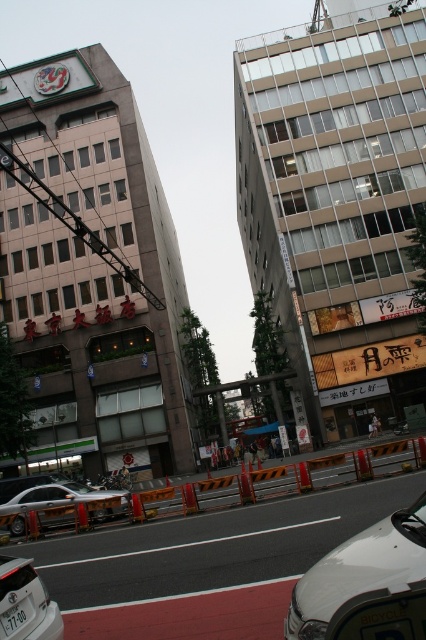
Question: Which of the following is the farthest from the observer?

Choices:
 (A) (57, 634)
 (B) (425, 492)
 (C) (374, 452)

Answer: (C)

Question: Does white matte car at lower left have a larger size compared to silver metallic sedan at center?

Choices:
 (A) yes
 (B) no

Answer: (A)

Question: Which object is closer to the camera taking this photo?

Choices:
 (A) silver metallic sedan at center
 (B) white glossy car at lower right
 (C) white plastic license plate at lower left

Answer: (B)

Question: Among these points, which one is nearest to the camera?

Choices:
 (A) (402, 570)
 (B) (115, 493)

Answer: (A)

Question: Does orange plastic barrier at center appear under white glossy car at lower right?

Choices:
 (A) no
 (B) yes

Answer: (B)

Question: Can you confirm if orange plastic barrier at center is smaller than white plastic license plate at lower left?

Choices:
 (A) yes
 (B) no

Answer: (B)